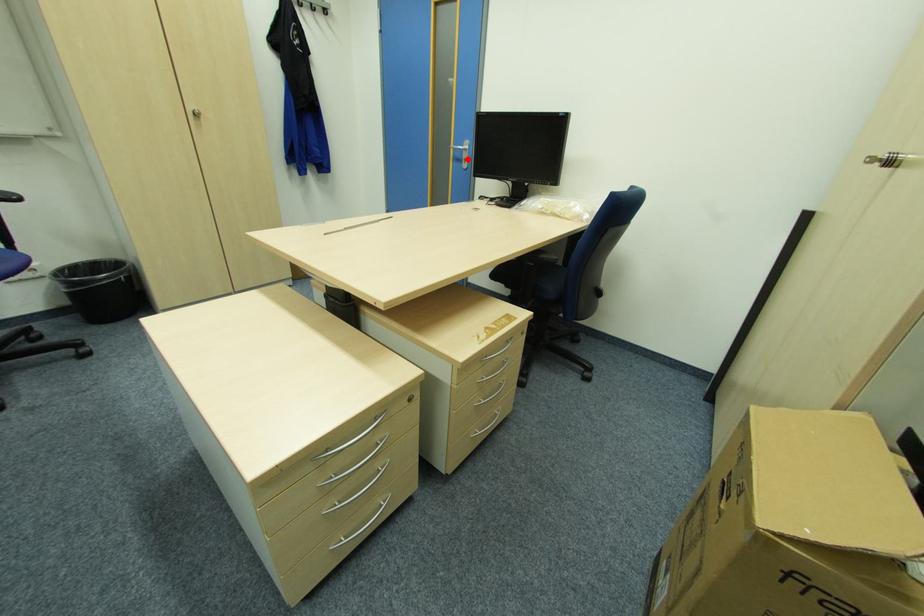
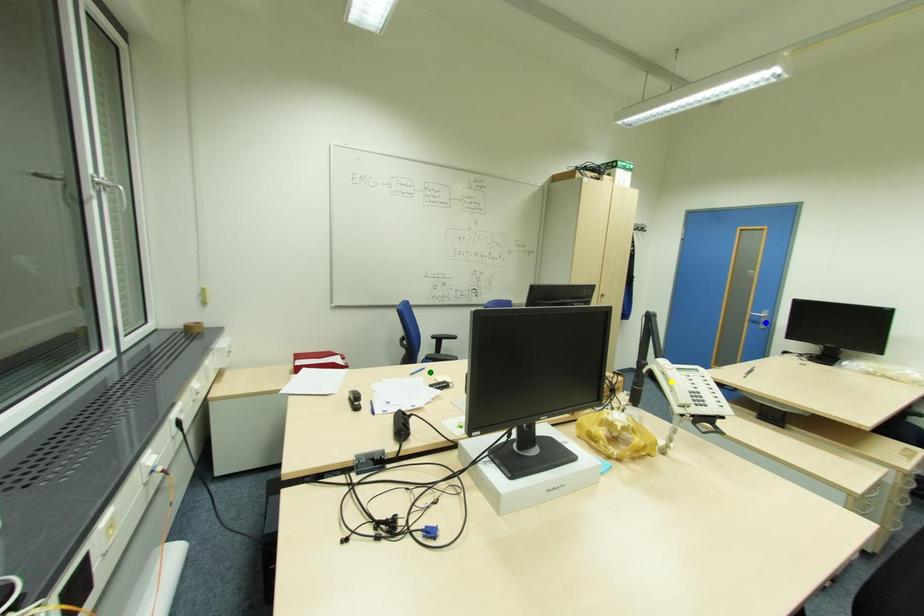
Question: I am providing you with two images of the same scene from different viewpoints. A red point is marked on the first image. You are given multiple points on the second image. Which point in image 2 represents the same 3d spot as the red point in image 1?

Choices:
 (A) yellow point
 (B) blue point
 (C) green point

Answer: (B)